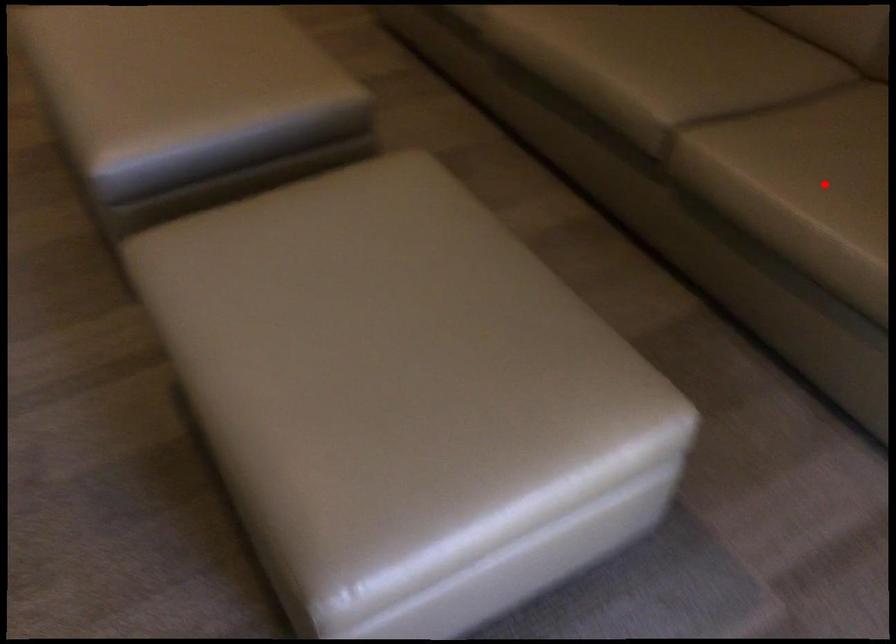
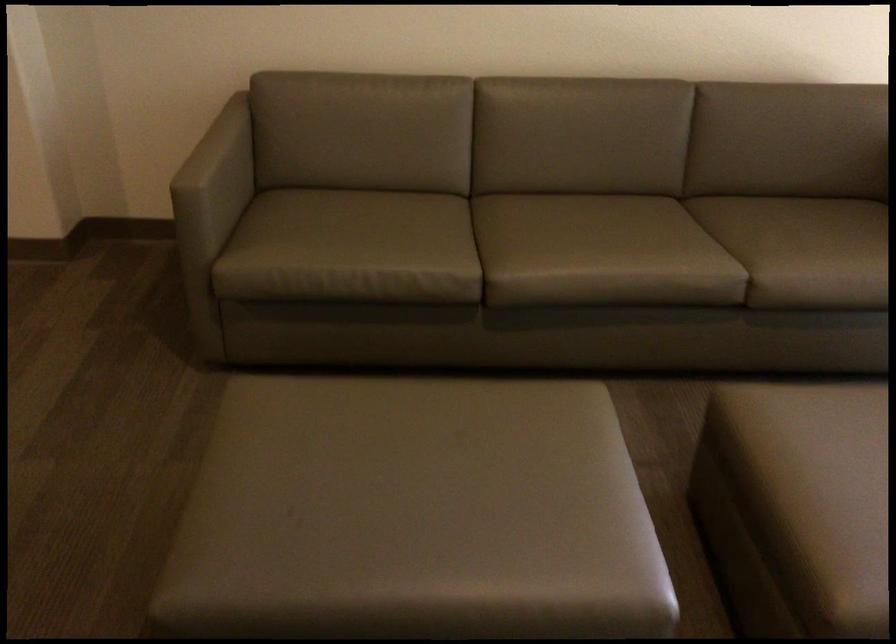
Find the pixel in the second image that matches the highlighted location in the first image.

(819, 251)